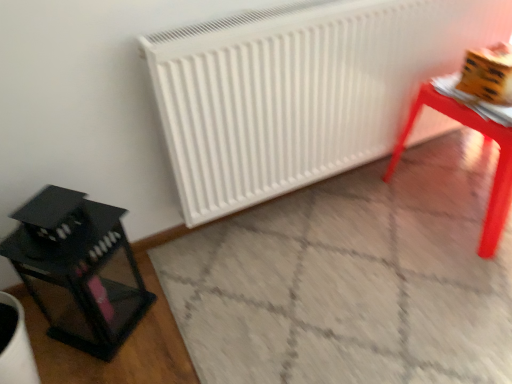
Where is `empty space that is to the right of black glass lantern at left`? This screenshot has height=384, width=512. empty space that is to the right of black glass lantern at left is located at coordinates (174, 312).